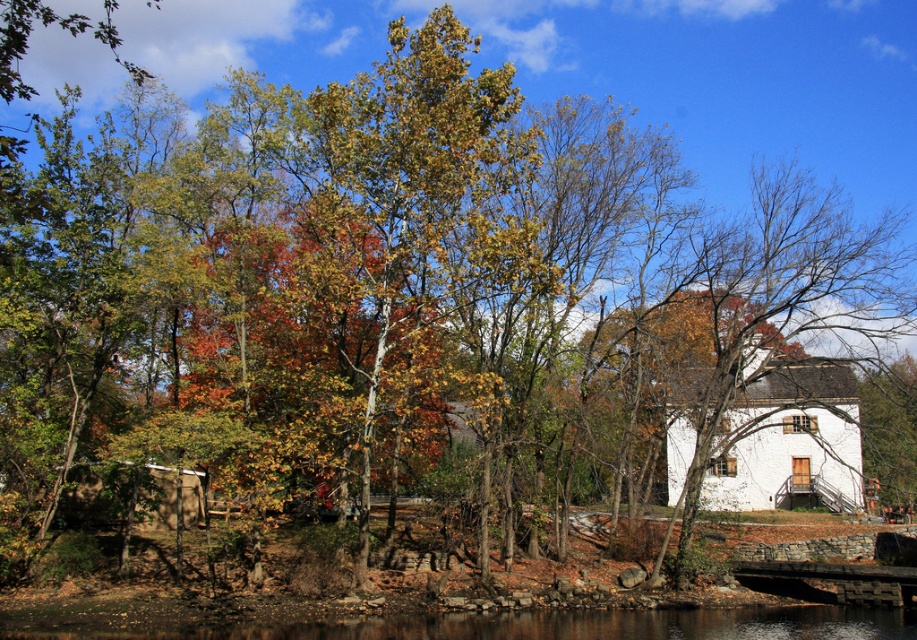
Question: Among these points, which one is nearest to the camera?

Choices:
 (A) (877, 598)
 (B) (172, 506)

Answer: (A)

Question: Does black reflective water at lower center appear on the right side of wooden cabin at lower left?

Choices:
 (A) no
 (B) yes

Answer: (B)

Question: From the image, what is the correct spatial relationship of black reflective water at lower center in relation to wooden cabin at lower left?

Choices:
 (A) above
 (B) below

Answer: (B)

Question: Does wooden cabin at lower left have a smaller size compared to stone bridge at lower right?

Choices:
 (A) no
 (B) yes

Answer: (A)

Question: Which point is farther from the camera taking this photo?

Choices:
 (A) (337, 621)
 (B) (750, 435)

Answer: (B)

Question: Which object is the closest to the wooden cabin at lower left?

Choices:
 (A) stone bridge at lower right
 (B) white matte house at center-right
 (C) black reflective water at lower center

Answer: (C)